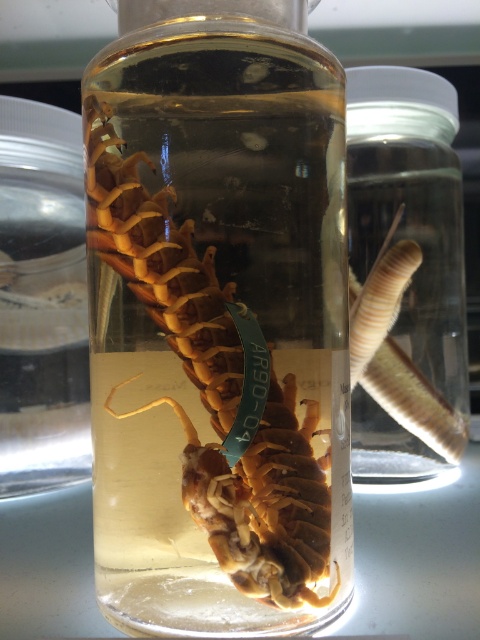
Consider the image. You are a researcher examining the jar containing the brown matte centipede at center. You notice a point marked at coordinates (204, 394). Where is this point located in relation to the brown matte centipede at center?

The point marked at coordinates (204, 394) is located on the brown matte centipede at center.

You are a researcher examining the jar containing both the brown matte centipede at center and the translucent glass worm at right. Which object takes up more space inside the jar?

The translucent glass worm at right occupies more space than the brown matte centipede at center inside the jar.

You are a researcher examining the jar containing the brown matte centipede at center. You need to determine if the centipede is positioned close enough to the front of the jar to be clearly visible under a microscope. The microscope requires the specimen to be within 8.5 inches from the lens. Can the centipede be observed clearly?

The brown matte centipede at center is 8.47 inches away from the viewer, which is within the 8.5 inches requirement. Therefore, the centipede can be observed clearly under the microscope.